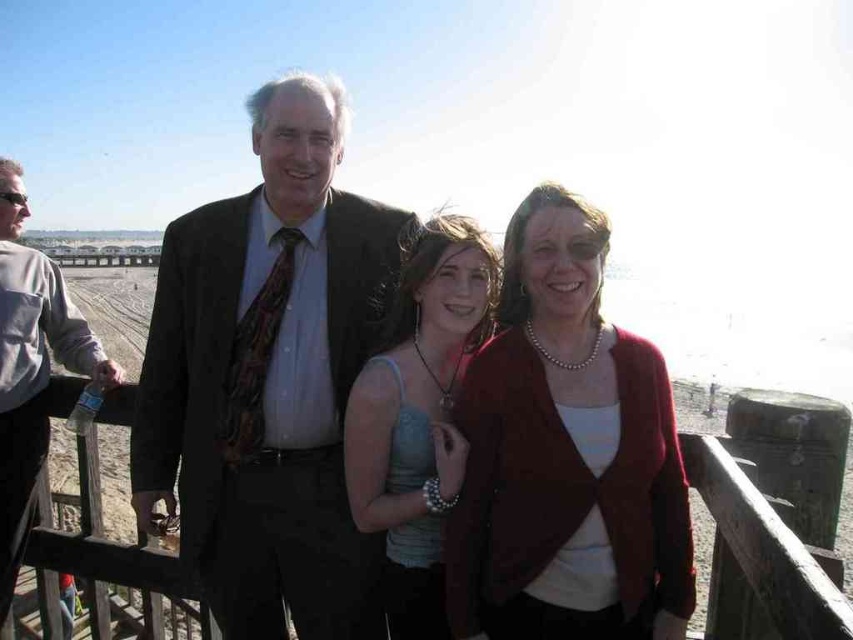
You are a photographer setting up a tripod at the beach. You need to position it between the matte black suit at center and the wooden at center to capture both in the frame. The tripod requires a minimum of 2 meters of space between the two objects to fit. Is there enough space?

The matte black suit at center is 3.21 meters away from the wooden at center. Since the required space is 2 meters, the tripod can be placed between them as the distance is sufficient.

You are a photographer trying to capture a closeup of the person standing at point (x=238, y=403) and the person at point (x=16, y=573). Since you want the closest person to the camera to be in focus, which point should you focus on?

Point (x=238, y=403) is further to the camera than point (x=16, y=573), so you should focus on point (x=238, y=403) to ensure the closest subject is in focus.